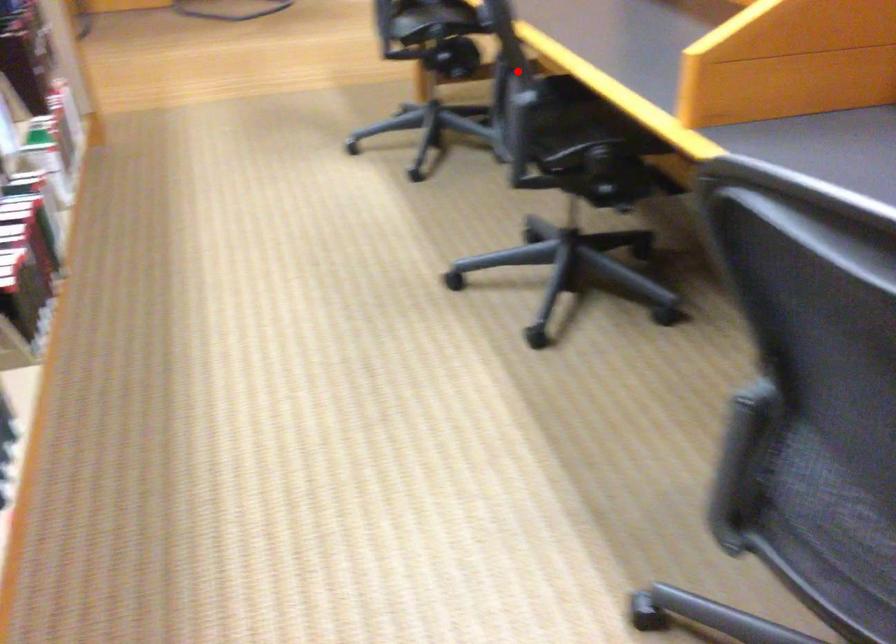
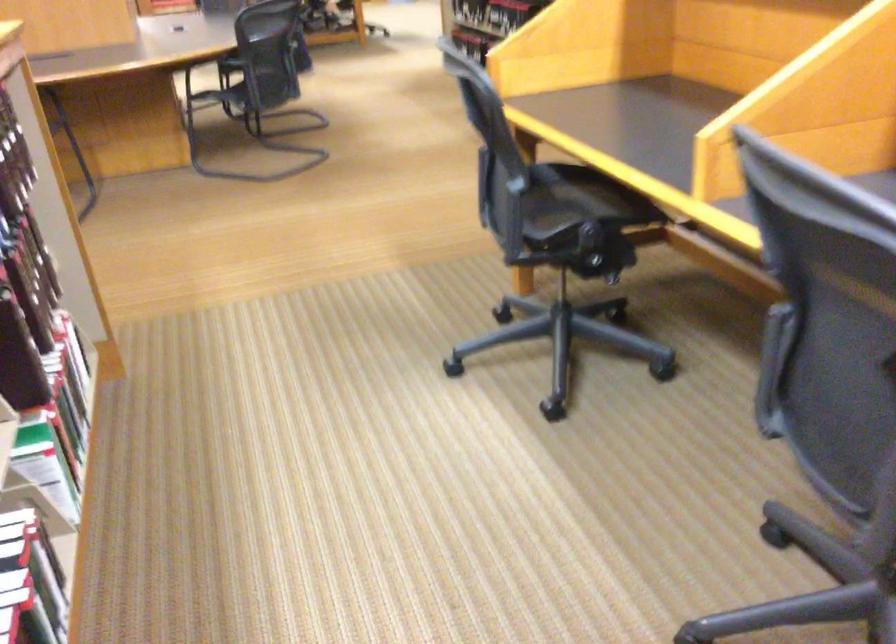
Question: I am providing you with two images of the same scene from different viewpoints. A red point is shown in image1. For the corresponding object point in image2, is it positioned nearer or farther from the camera?

Choices:
 (A) Nearer
 (B) Farther

Answer: (A)